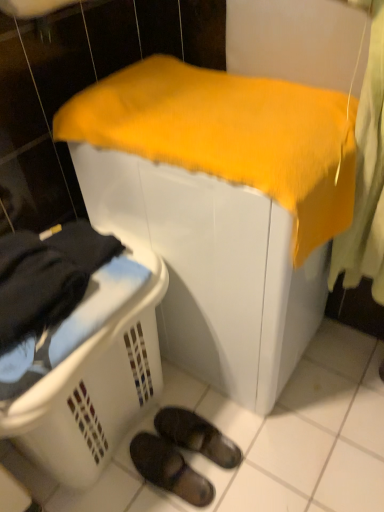
The height and width of the screenshot is (512, 384). In order to click on free point below black rubber slippers at lower center, the first footwear when ordered from bottom to top (from a real-world perspective) in this screenshot , I will do `click(172, 480)`.